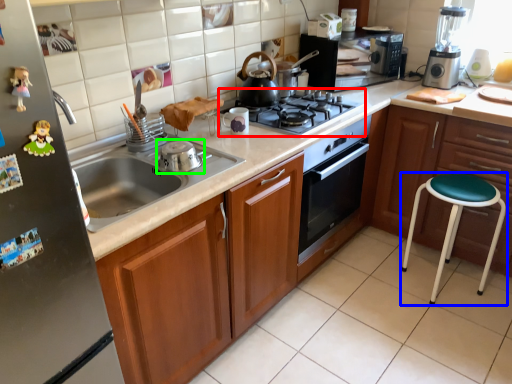
Question: Considering the real-world distances, which object is closest to gas stove (highlighted by a red box)? stool (highlighted by a blue box) or appliance (highlighted by a green box).

Choices:
 (A) stool
 (B) appliance

Answer: (B)